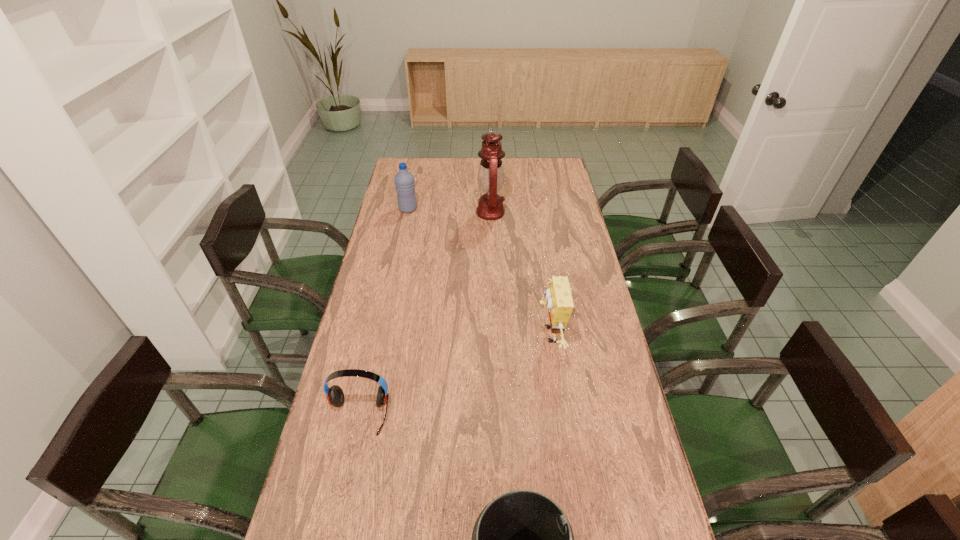
Where is `free spot located with the microphone attached to the side of the fourth farthest object`? The width and height of the screenshot is (960, 540). free spot located with the microphone attached to the side of the fourth farthest object is located at coordinates (350, 454).

Locate an element on the screen. water bottle that is at the left edge is located at coordinates (404, 180).

The width and height of the screenshot is (960, 540). Find the location of `headset situated at the left edge`. headset situated at the left edge is located at coordinates (335, 395).

Identify the location of object located at the right edge. (559, 301).

Where is `vacant space at the far edge of the desktop`? vacant space at the far edge of the desktop is located at coordinates (524, 168).

The height and width of the screenshot is (540, 960). Find the location of `vacant space at the left edge of the desktop`. vacant space at the left edge of the desktop is located at coordinates (326, 494).

Identify the location of free space at the right edge of the desktop. (561, 222).

Locate an element on the screen. The image size is (960, 540). free space at the far left corner of the desktop is located at coordinates (418, 177).

Where is `vacant area that lies between the third farthest object and the water bottle`? This screenshot has height=540, width=960. vacant area that lies between the third farthest object and the water bottle is located at coordinates (478, 272).

Locate an element on the screen. This screenshot has width=960, height=540. free spot between the oil lamp and the third nearest object is located at coordinates (519, 274).